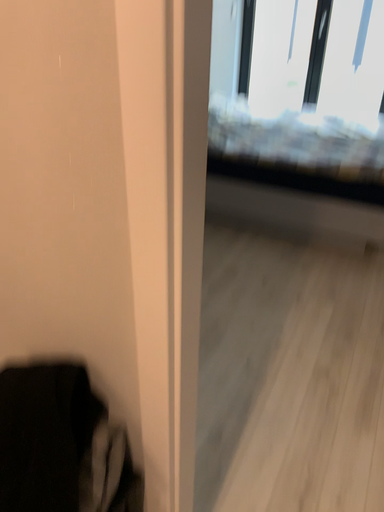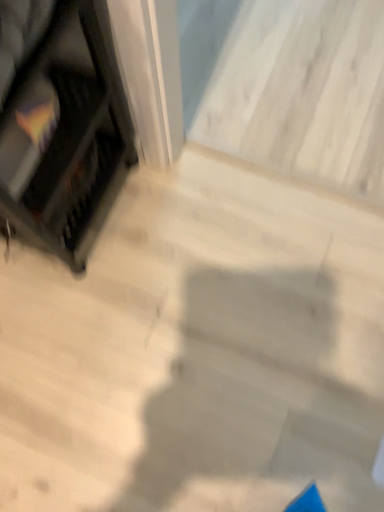
Question: Which way did the camera rotate in the video?

Choices:
 (A) rotated upward
 (B) rotated downward

Answer: (B)